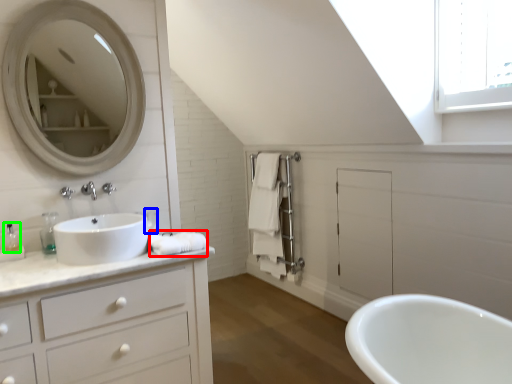
Question: Which is nearer to the bath towel (highlighted by a red box)? toiletry (highlighted by a blue box) or toiletry (highlighted by a green box).

Choices:
 (A) toiletry
 (B) toiletry

Answer: (A)